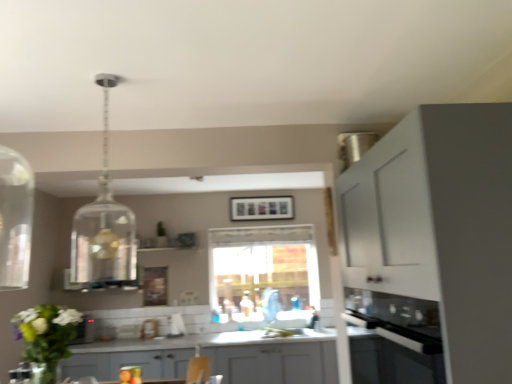
The height and width of the screenshot is (384, 512). Describe the element at coordinates (246, 304) in the screenshot. I see `translucent glass bottle at center` at that location.

What is the approximate width of black glass oven at lower right?

11.44 inches.

This screenshot has width=512, height=384. In order to click on black glass oven at lower right in this screenshot , I will do pos(394,339).

Find the location of a particular element. The width and height of the screenshot is (512, 384). white matte cabinet at right, arranged as the second cabinetry when viewed from the back is located at coordinates (437, 233).

How much space does white matte cabinet at right, which is the 1th cabinetry in top-to-bottom order, occupy vertically?

The height of white matte cabinet at right, which is the 1th cabinetry in top-to-bottom order, is 1.24 meters.

The width and height of the screenshot is (512, 384). What are the coordinates of `transparent glass window at center` in the screenshot? It's located at (265, 274).

Does gray matte cabinet at center, which appears as the 1th cabinetry when ordered from the bottom, appear on the left side of clear glass pendant light at upper center?

No.

Considering the relative sizes of gray matte cabinet at center, which ranks as the first cabinetry in back-to-front order, and clear glass pendant light at upper center in the image provided, is gray matte cabinet at center, which ranks as the first cabinetry in back-to-front order, shorter than clear glass pendant light at upper center?

Yes, gray matte cabinet at center, which ranks as the first cabinetry in back-to-front order, is shorter than clear glass pendant light at upper center.

Considering the sizes of objects gray matte cabinet at center, which is the second cabinetry in front-to-back order, and clear glass pendant light at upper center in the image provided, who is thinner, gray matte cabinet at center, which is the second cabinetry in front-to-back order, or clear glass pendant light at upper center?

With smaller width is clear glass pendant light at upper center.

Does gray matte cabinet at center, which ranks as the first cabinetry in back-to-front order, contain clear glass pendant light at upper center?

No, clear glass pendant light at upper center is not a part of gray matte cabinet at center, which ranks as the first cabinetry in back-to-front order.

Is black glass oven at lower right beside transparent glass window at center?

No, black glass oven at lower right is not next to transparent glass window at center.

From a real-world perspective, which object stands above the other?

transparent glass window at center is physically above.

Is point (380, 350) in front of point (216, 286)?

Yes, point (380, 350) is closer to viewer.

Where is `window lying behind the black glass oven at lower right`? This screenshot has width=512, height=384. window lying behind the black glass oven at lower right is located at coordinates (265, 274).

How much distance is there between transparent glass window at center and black glass oven at lower right?

They are 8.87 feet apart.

From a real-world perspective, is transparent glass window at center physically located above or below black glass oven at lower right?

transparent glass window at center is above black glass oven at lower right.

Can you tell me how much transparent glass window at center and black glass oven at lower right differ in facing direction?

→ 90.5 degrees.

Considering the sizes of objects transparent glass window at center and black glass oven at lower right in the image provided, who is thinner, transparent glass window at center or black glass oven at lower right?

Thinner between the two is transparent glass window at center.

Is point (244, 303) positioned before point (318, 285)?

That is False.

Considering the sizes of objects translucent glass bottle at center and transparent glass window at center in the image provided, who is wider, translucent glass bottle at center or transparent glass window at center?

translucent glass bottle at center is wider.

Are translucent glass bottle at center and transparent glass window at center far apart?

No, translucent glass bottle at center is in close proximity to transparent glass window at center.

Is point (245, 300) closer to viewer compared to point (88, 222)?

That is False.

Considering the sizes of objects translucent glass bottle at center and clear glass pendant light at upper center in the image provided, who is smaller, translucent glass bottle at center or clear glass pendant light at upper center?

translucent glass bottle at center.

From the image's perspective, is translucent glass bottle at center on top of clear glass pendant light at upper center?

No, from the image's perspective, translucent glass bottle at center is not over clear glass pendant light at upper center.

Measure the distance between transparent glass window at center and gray matte cabinet at center, which appears as the 1th cabinetry when ordered from the bottom.

32.39 inches.

Is transparent glass window at center positioned beyond the bounds of gray matte cabinet at center, which appears as the 1th cabinetry when ordered from the bottom?

Yes.

Considering the relative positions of transparent glass window at center and gray matte cabinet at center, which appears as the 1th cabinetry when ordered from the bottom, in the image provided, is transparent glass window at center to the right of gray matte cabinet at center, which appears as the 1th cabinetry when ordered from the bottom, from the viewer's perspective?

Yes.

Considering the relative sizes of transparent glass window at center and gray matte cabinet at center, which is the 2th cabinetry from top to bottom, in the image provided, is transparent glass window at center taller than gray matte cabinet at center, which is the 2th cabinetry from top to bottom,?

Yes.

Considering the relative sizes of clear glass pendant light at upper center and translucent glass bottle at center in the image provided, is clear glass pendant light at upper center smaller than translucent glass bottle at center?

Actually, clear glass pendant light at upper center might be larger than translucent glass bottle at center.

Are clear glass pendant light at upper center and translucent glass bottle at center beside each other?

They are not placed beside each other.

Does clear glass pendant light at upper center have a greater height compared to translucent glass bottle at center?

Yes, clear glass pendant light at upper center is taller than translucent glass bottle at center.

From a real-world perspective, is clear glass pendant light at upper center located higher than translucent glass bottle at center?

Yes.

From a real-world perspective, which cabinetry is the 2nd one underneath the clear glass pendant light at upper center? Please provide its 2D coordinates.

[(214, 358)]

Where is `oven to the right of transparent glass window at center`? oven to the right of transparent glass window at center is located at coordinates (394, 339).

From the image, which object appears to be nearer to black glass oven at lower right, gray matte cabinet at center, which ranks as the first cabinetry in back-to-front order, or white matte cabinet at right, the 1th cabinetry when ordered from front to back?

white matte cabinet at right, the 1th cabinetry when ordered from front to back, is closer to black glass oven at lower right.

Considering their positions, is gray matte cabinet at center, which appears as the 1th cabinetry when ordered from the bottom, positioned closer to clear glass pendant light at upper center than black glass oven at lower right?

black glass oven at lower right is positioned closer to the anchor clear glass pendant light at upper center.

When comparing their distances from matte black picture frame at center, does clear glass pendant light at upper center or translucent glass bottle at center seem further?

Based on the image, clear glass pendant light at upper center appears to be further to matte black picture frame at center.

From the image, which object appears to be nearer to clear glass pendant light at upper center, matte black picture frame at center or gray matte cabinet at center, which is the second cabinetry in front-to-back order?

gray matte cabinet at center, which is the second cabinetry in front-to-back order, lies closer to clear glass pendant light at upper center than the other object.

Looking at the image, which one is located closer to matte black picture frame at center, gray matte cabinet at center, which ranks as the first cabinetry in back-to-front order, or transparent glass window at center?

Based on the image, transparent glass window at center appears to be nearer to matte black picture frame at center.

From the image, which object appears to be nearer to clear glass pendant light at upper center, translucent glass bottle at center or white matte cabinet at right, which is the 1th cabinetry in top-to-bottom order?

white matte cabinet at right, which is the 1th cabinetry in top-to-bottom order, is closer to clear glass pendant light at upper center.

Based on the photo, looking at the image, which one is located closer to clear glass pendant light at upper center, white matte cabinet at right, the 1th cabinetry when ordered from front to back, or transparent glass window at center?

The object closer to clear glass pendant light at upper center is white matte cabinet at right, the 1th cabinetry when ordered from front to back.

From the image, which object appears to be nearer to matte black picture frame at center, white matte cabinet at right, which is counted as the second cabinetry, starting from the bottom, or black glass oven at lower right?

black glass oven at lower right.

Where is `light fixture positioned between white matte cabinet at right, which is the 1th cabinetry in top-to-bottom order, and gray matte cabinet at center, which is the 2th cabinetry from top to bottom, from near to far`? The height and width of the screenshot is (384, 512). light fixture positioned between white matte cabinet at right, which is the 1th cabinetry in top-to-bottom order, and gray matte cabinet at center, which is the 2th cabinetry from top to bottom, from near to far is located at coordinates (104, 225).

Find the location of a particular element. The height and width of the screenshot is (384, 512). cabinetry between clear glass pendant light at upper center and matte black picture frame at center from front to back is located at coordinates (214, 358).

Identify the location of cabinetry between clear glass pendant light at upper center and transparent glass window at center along the z-axis. This screenshot has width=512, height=384. (214, 358).

At what (x,y) coordinates should I click in order to perform the action: click on cabinetry between white matte cabinet at right, arranged as the second cabinetry when viewed from the back, and matte black picture frame at center from front to back. Please return your answer as a coordinate pair (x, y). This screenshot has height=384, width=512. Looking at the image, I should click on (214, 358).